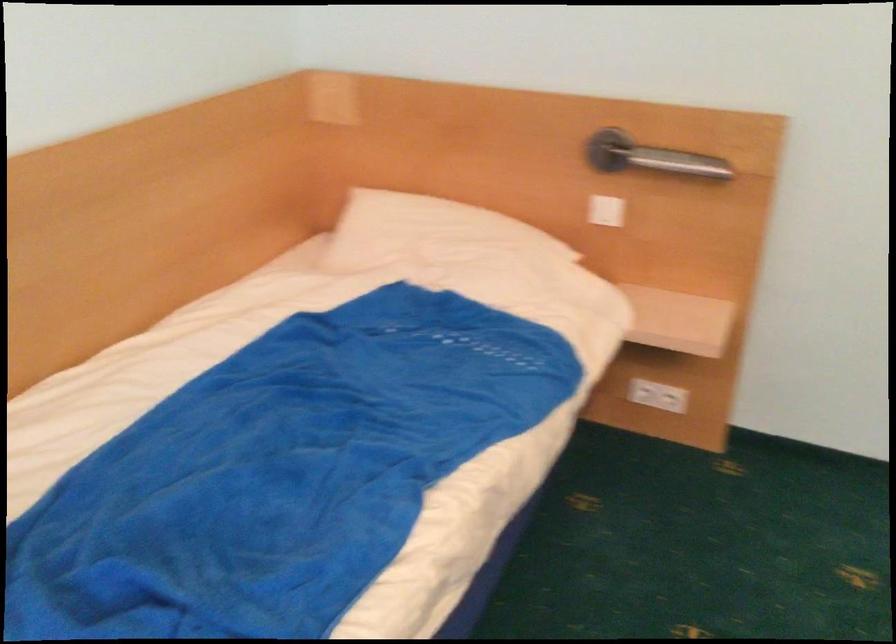
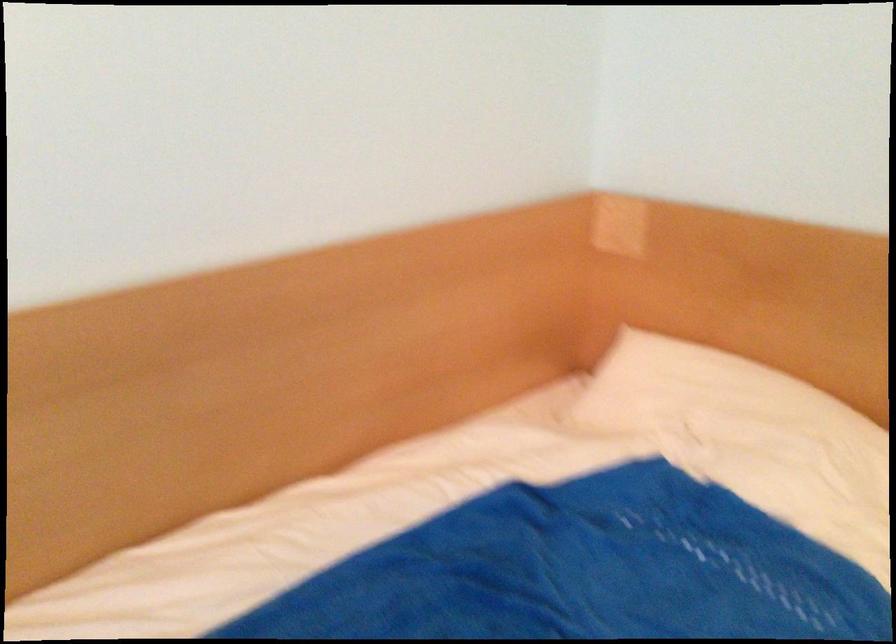
Question: Based on the continuous images, in which direction is the camera rotating? Reply with the corresponding letter.

Choices:
 (A) Left
 (B) Right
 (C) Up
 (D) Down

Answer: (A)